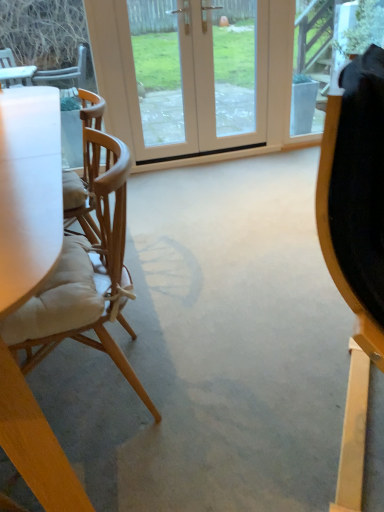
Question: Is light beige fabric chair at left outside white glossy door at center?

Choices:
 (A) no
 (B) yes

Answer: (B)

Question: Is light beige fabric chair at left facing towards white glossy door at center?

Choices:
 (A) no
 (B) yes

Answer: (A)

Question: Does light beige fabric chair at left have a lesser width compared to white glossy door at center?

Choices:
 (A) yes
 (B) no

Answer: (B)

Question: Is light beige fabric chair at left oriented away from white glossy door at center?

Choices:
 (A) no
 (B) yes

Answer: (A)

Question: Is light beige fabric chair at left to the right of white glossy door at center from the viewer's perspective?

Choices:
 (A) no
 (B) yes

Answer: (A)

Question: Can you confirm if light beige fabric chair at left is bigger than white glossy door at center?

Choices:
 (A) yes
 (B) no

Answer: (A)

Question: From the image's perspective, is white glossy door at center above light beige fabric chair at left?

Choices:
 (A) no
 (B) yes

Answer: (B)

Question: Is the position of white glossy door at center more distant than that of light beige fabric chair at left?

Choices:
 (A) yes
 (B) no

Answer: (A)

Question: Can you confirm if white glossy door at center is wider than light beige fabric chair at left?

Choices:
 (A) no
 (B) yes

Answer: (A)

Question: Can you confirm if white glossy door at center is positioned to the right of light beige fabric chair at left?

Choices:
 (A) no
 (B) yes

Answer: (B)

Question: Is white glossy door at center placed right next to light beige fabric chair at left?

Choices:
 (A) no
 (B) yes

Answer: (A)

Question: Can you confirm if white glossy door at center is thinner than light beige fabric chair at left?

Choices:
 (A) no
 (B) yes

Answer: (B)

Question: From a real-world perspective, is white glossy door at center positioned above or below light beige fabric chair at left?

Choices:
 (A) below
 (B) above

Answer: (B)